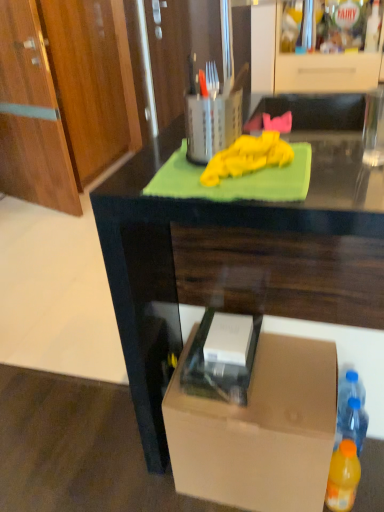
Question: Is orange plastic bottle at lower right, placed as the second bottle when sorted from back to front, inside or outside of matte wood cabinet at upper center?

Choices:
 (A) inside
 (B) outside

Answer: (B)

Question: In the image, is orange plastic bottle at lower right, placed as the second bottle when sorted from back to front, positioned in front of or behind matte wood cabinet at upper center?

Choices:
 (A) behind
 (B) front

Answer: (B)

Question: Estimate the real-world distances between objects in this image. Which object is farther from the matte wood cabinet at upper center?

Choices:
 (A) dark wood desk at center
 (B) brown cardboard box at lower right
 (C) orange plastic bottle at lower right, positioned as the 1th bottle in front-to-back order
 (D) metallic silver utensil holder at upper center
 (E) blue plastic bottle at lower right, which ranks as the first bottle in back-to-front order

Answer: (C)

Question: Which object is positioned closest to the blue plastic bottle at lower right, which ranks as the first bottle in back-to-front order?

Choices:
 (A) metallic silver utensil holder at upper center
 (B) matte wood cabinet at upper center
 (C) orange plastic bottle at lower right, positioned as the 1th bottle in front-to-back order
 (D) brown cardboard box at lower right
 (E) dark wood desk at center

Answer: (C)